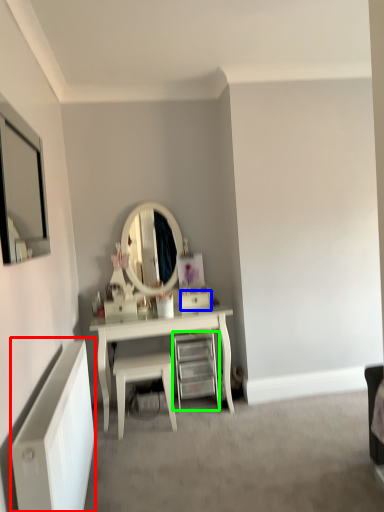
Question: Considering the real-world distances, which object is closest to radiator (highlighted by a red box)? drawer (highlighted by a blue box) or shelf (highlighted by a green box).

Choices:
 (A) drawer
 (B) shelf

Answer: (B)